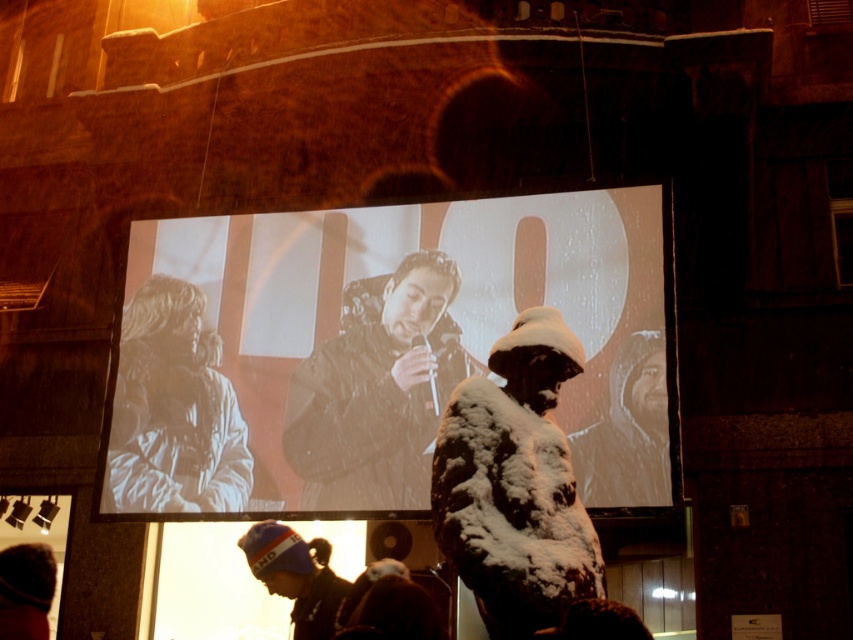
You are a photographer trying to capture a clear shot of both the matte black jacket at center and the white textured coat at left. Based on their positions and sizes, which one do you think will appear larger in the photo?

The matte black jacket at center might appear larger in the photo because it could be wider than the white textured coat at left according to the description.

You are standing in the nighttime urban scene and want to locate the matte black jacket at center. According to the scene description, where would you find it?

The matte black jacket at center is located at point (376,349).